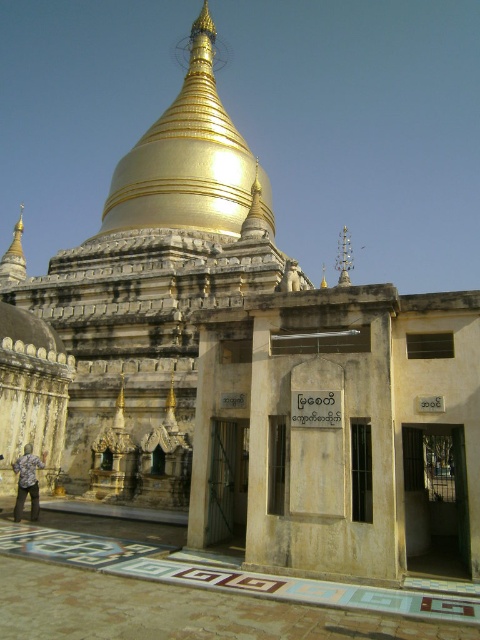
You are a visitor standing at the entrance of the temple complex and see the gold polished dome at center and the printed cotton shirt at lower left. Which object is positioned to the right of the other?

The gold polished dome at center is to the right of the printed cotton shirt at lower left.

You are standing at point (214,109) and want to reach the golden stupa. The temple complex has a rule that you must stay within 100 meters of the golden stupa at all times. Can you safely walk directly to the golden stupa from your current position?

The distance between point (214,109) and the golden stupa is 112.81 meters, which exceeds the 100 meter rule. Therefore, you cannot safely walk directly to the golden stupa from your current position as it would take you beyond the allowed distance.

You are a photographer planning to capture the gold polished dome at center and the printed cotton shirt at lower left in a single frame. Based on their sizes, which object should you focus on to ensure both are clearly visible in your photo?

The gold polished dome at center is wider than the printed cotton shirt at lower left, so focusing on the gold polished dome at center will help ensure both objects are clearly visible in the photo.